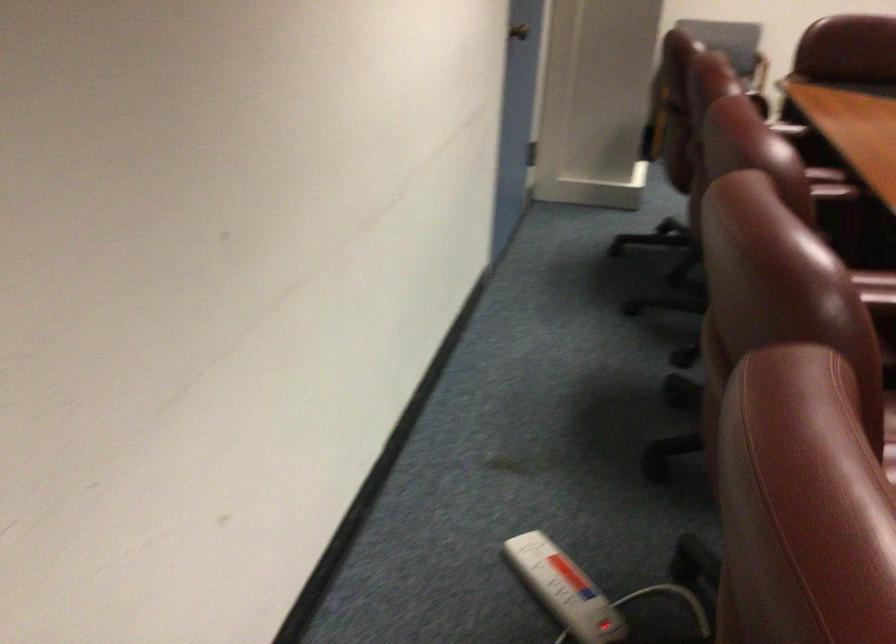
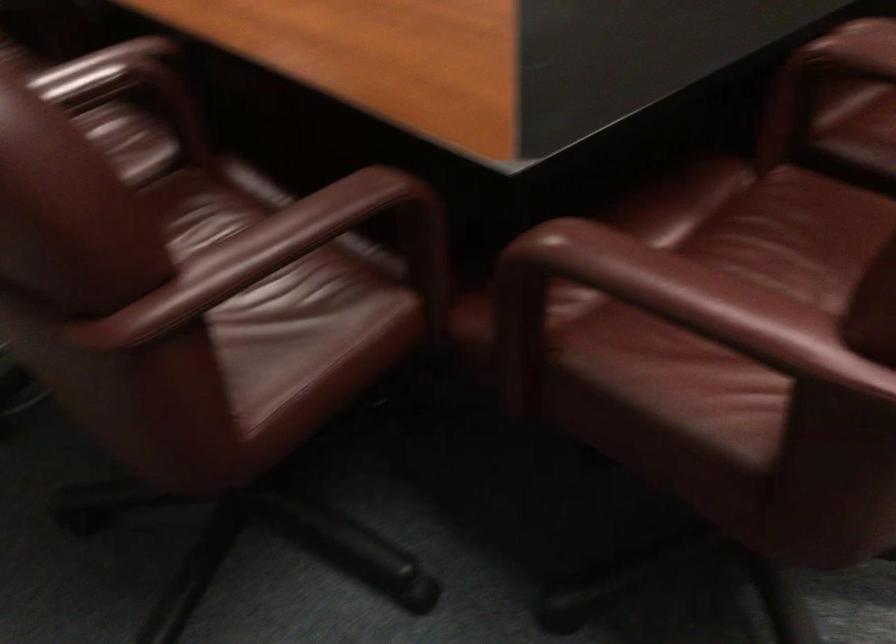
Question: In a continuous first-person perspective shot, in which direction is the camera moving?

Choices:
 (A) Left
 (B) Right
 (C) Forward
 (D) Backward

Answer: (D)